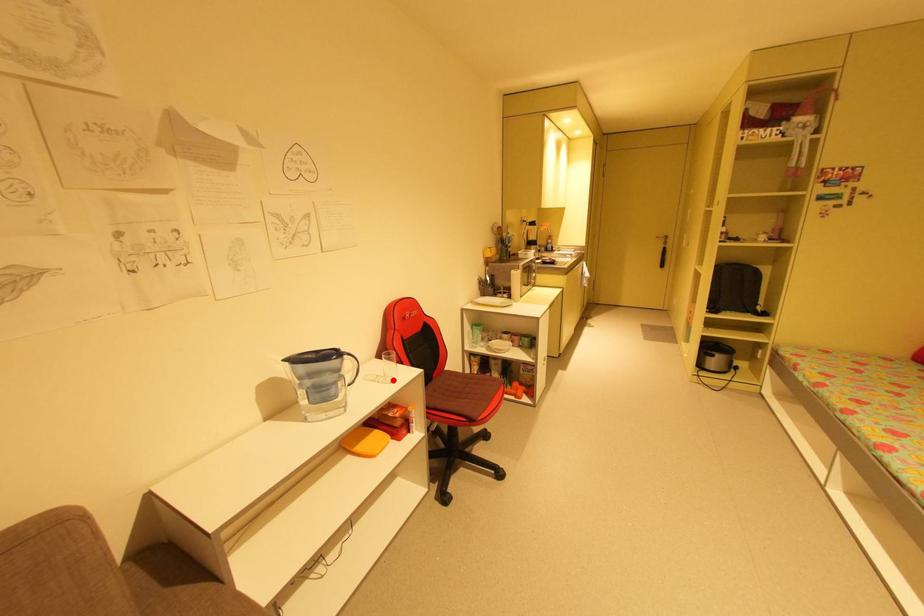
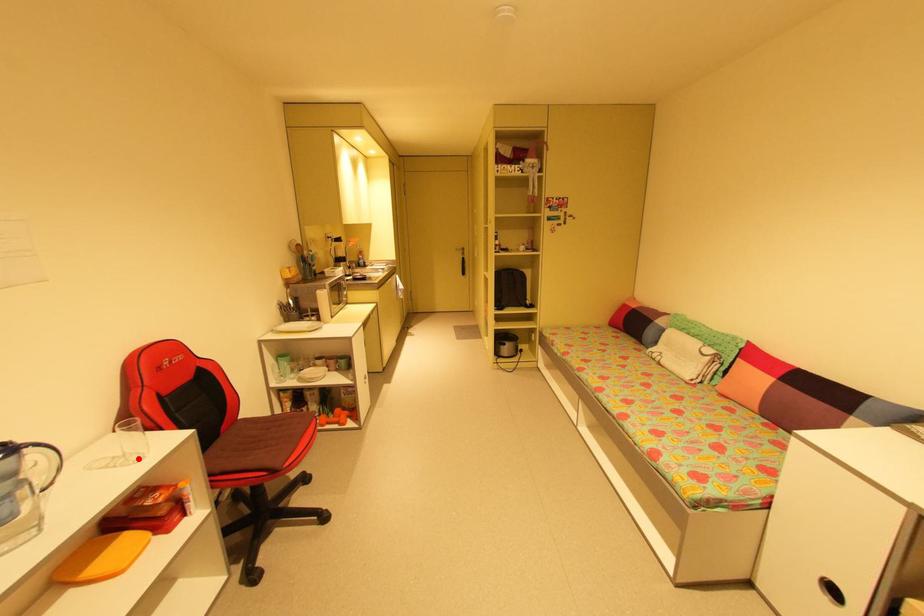
I am providing you with two images of the same scene from different viewpoints. A red point is marked on the first image and another point is marked on the second image. Is the marked point in image1 the same physical position as the marked point in image2?

Yes